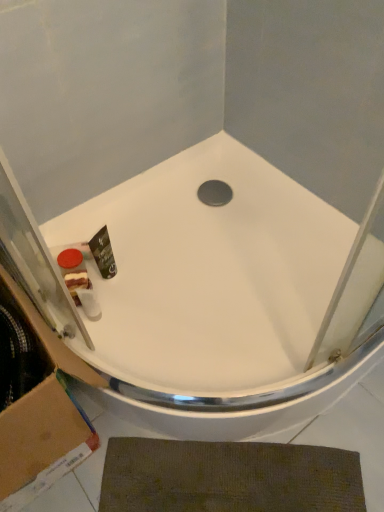
Question: Does matte plastic soap at lower left have a lesser height compared to brown textured bath mat at lower center?

Choices:
 (A) yes
 (B) no

Answer: (B)

Question: From the image's perspective, is matte plastic soap at lower left below brown textured bath mat at lower center?

Choices:
 (A) no
 (B) yes

Answer: (A)

Question: Would you say matte plastic soap at lower left contains brown textured bath mat at lower center?

Choices:
 (A) yes
 (B) no

Answer: (B)

Question: Considering the relative positions of matte plastic soap at lower left and brown textured bath mat at lower center in the image provided, is matte plastic soap at lower left to the left of brown textured bath mat at lower center from the viewer's perspective?

Choices:
 (A) no
 (B) yes

Answer: (B)

Question: Is matte plastic soap at lower left positioned before brown textured bath mat at lower center?

Choices:
 (A) no
 (B) yes

Answer: (A)

Question: Considering the positions of point (72, 265) and point (243, 502), is point (72, 265) closer or farther from the camera than point (243, 502)?

Choices:
 (A) farther
 (B) closer

Answer: (A)

Question: Relative to brown textured bath mat at lower center, is matte plastic soap at lower left in front or behind?

Choices:
 (A) front
 (B) behind

Answer: (B)

Question: Based on their sizes in the image, would you say matte plastic soap at lower left is bigger or smaller than brown textured bath mat at lower center?

Choices:
 (A) small
 (B) big

Answer: (A)

Question: From a real-world perspective, is matte plastic soap at lower left positioned above or below brown textured bath mat at lower center?

Choices:
 (A) below
 (B) above

Answer: (B)

Question: Based on their positions, is brown cardboard at lower left located to the left or right of matte plastic soap at lower left?

Choices:
 (A) right
 (B) left

Answer: (B)

Question: From a real-world perspective, is brown cardboard at lower left above or below matte plastic soap at lower left?

Choices:
 (A) below
 (B) above

Answer: (B)

Question: Considering their positions, is brown cardboard at lower left located in front of or behind matte plastic soap at lower left?

Choices:
 (A) behind
 (B) front

Answer: (B)

Question: Is brown cardboard at lower left taller or shorter than matte plastic soap at lower left?

Choices:
 (A) tall
 (B) short

Answer: (A)

Question: Looking at the image, does brown textured bath mat at lower center seem bigger or smaller compared to white glossy bathtub at center?

Choices:
 (A) big
 (B) small

Answer: (B)

Question: Do you think brown textured bath mat at lower center is within white glossy bathtub at center, or outside of it?

Choices:
 (A) outside
 (B) inside

Answer: (A)